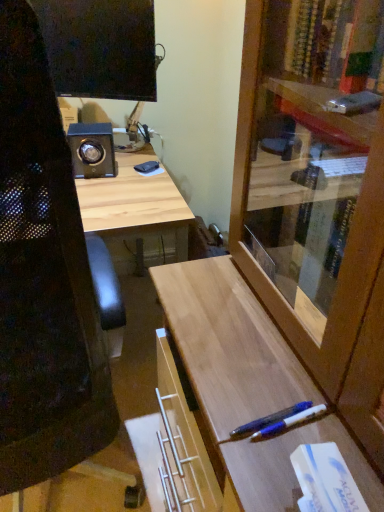
Question: From a real-world perspective, relative to white matte book at lower right, is black mesh computer chair at left vertically above or below?

Choices:
 (A) above
 (B) below

Answer: (B)

Question: Is black mesh computer chair at left in front of or behind white matte book at lower right in the image?

Choices:
 (A) behind
 (B) front

Answer: (B)

Question: Which is nearer to the black mesh computer chair at left?

Choices:
 (A) translucent blue pen at lower right
 (B) wooden cabinet at center-right
 (C) white matte book at lower right

Answer: (A)

Question: Considering the real-world distances, which object is closest to the white matte book at lower right?

Choices:
 (A) black mesh computer chair at left
 (B) wooden cabinet at center-right
 (C) translucent blue pen at lower right

Answer: (C)